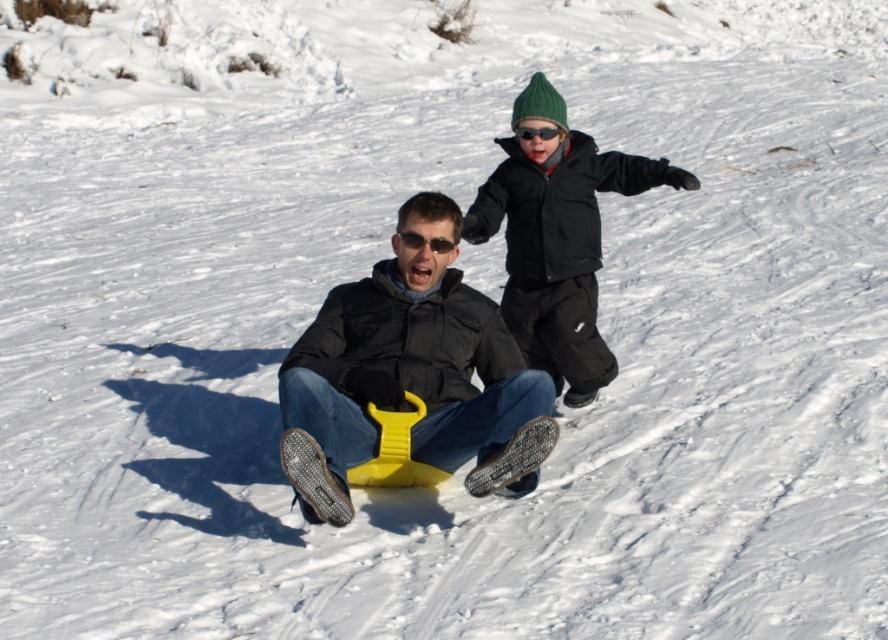
Question: Which of the following is the farthest from the observer?

Choices:
 (A) (311, 432)
 (B) (519, 136)

Answer: (B)

Question: Is yellow plastic sled at center below black plastic goggles at upper center?

Choices:
 (A) no
 (B) yes

Answer: (B)

Question: Can you confirm if yellow plastic sled at center is positioned to the left of green knit hat at upper right?

Choices:
 (A) yes
 (B) no

Answer: (A)

Question: Does yellow plastic sled at center have a larger size compared to matte black jacket at center?

Choices:
 (A) yes
 (B) no

Answer: (A)

Question: Based on their relative distances, which object is nearer to the matte black jacket at center?

Choices:
 (A) black plastic goggles at upper center
 (B) yellow plastic sled at center
 (C) green knit hat at upper right

Answer: (B)

Question: Among these objects, which one is farthest from the camera?

Choices:
 (A) matte black jacket at center
 (B) green knit hat at upper right
 (C) yellow plastic sled at center

Answer: (B)